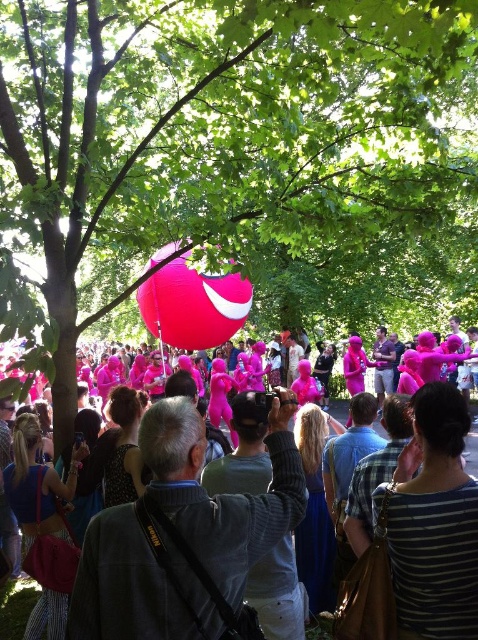
What do you see at coordinates (210, 140) in the screenshot?
I see `green leafy tree at upper center` at bounding box center [210, 140].

Can you confirm if green leafy tree at upper center is wider than pink matte balloon at center?

Yes.

Which is in front, point (10, 128) or point (341, 419)?

Point (10, 128) is more forward.

Where is `green leafy tree at upper center`? This screenshot has height=640, width=478. green leafy tree at upper center is located at coordinates click(x=210, y=140).

Can you confirm if glossy pink balloon at center is thinner than pink matte balloon at center?

Indeed, glossy pink balloon at center has a lesser width compared to pink matte balloon at center.

Which of these two, glossy pink balloon at center or pink matte balloon at center, stands taller?

With more height is pink matte balloon at center.

Is point (171, 275) positioned in front of point (15, 593)?

No, (171, 275) is further to viewer.

Find the location of `glossy pink balloon at center`. glossy pink balloon at center is located at coordinates (193, 305).

Is green leafy tree at upper center taller than glossy pink balloon at center?

Yes, green leafy tree at upper center is taller than glossy pink balloon at center.

Where is `green leafy tree at upper center`? Image resolution: width=478 pixels, height=640 pixels. green leafy tree at upper center is located at coordinates (210, 140).

Where is `green leafy tree at upper center`? This screenshot has height=640, width=478. green leafy tree at upper center is located at coordinates (210, 140).